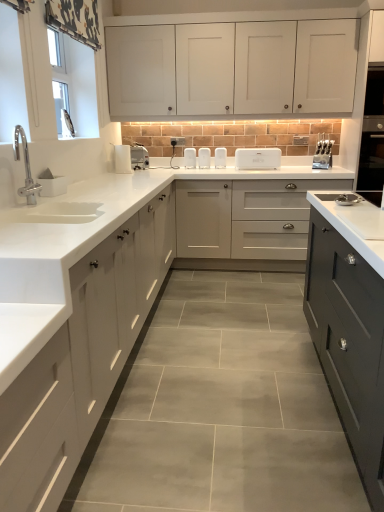
Identify the location of free spot behind white matte soap dish at left, the first appliance positioned from the left. (x=80, y=187).